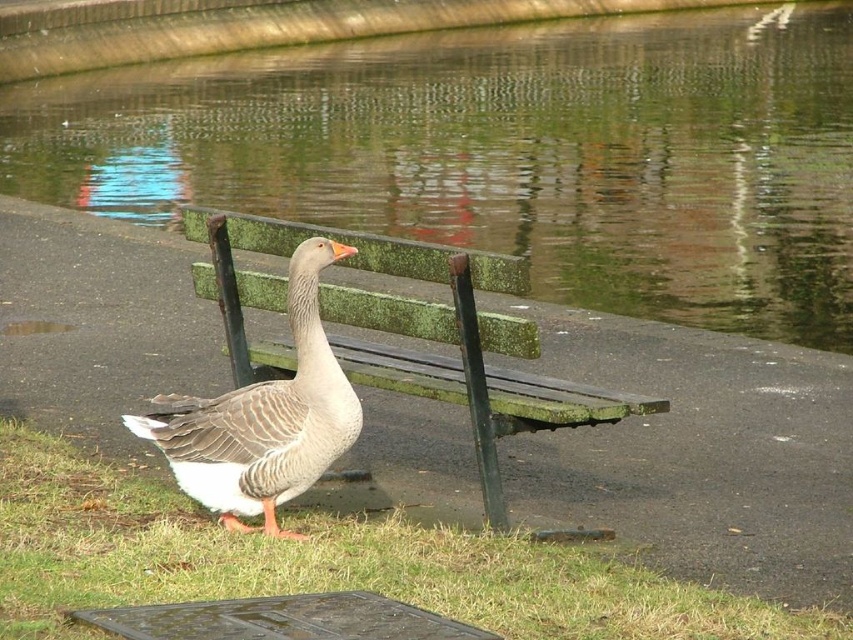
You are standing at the wooden bench and want to walk towards the goose. Which point, point (364, 150) or point (303, 317), is closer to your current position?

Point (364, 150) is closer to your current position at the wooden bench because it is further to the viewer than point (303, 317).

Based on the photo, you are at the park and want to sit on the green mossy bench at center. However, you notice the greenish water at bench right. Based on their heights, is the bench higher or lower than the water level?

The greenish water at bench right is much taller than the green mossy bench at center, which means the water level is higher than the bench. Therefore, the bench is lower than the water level.